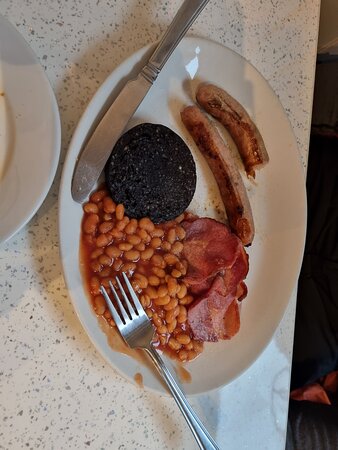
At what (x,y) coordinates should I click in order to perform the action: click on butter knife. Please return your answer as a coordinate pair (x, y). The width and height of the screenshot is (338, 450). Looking at the image, I should click on (111, 128).